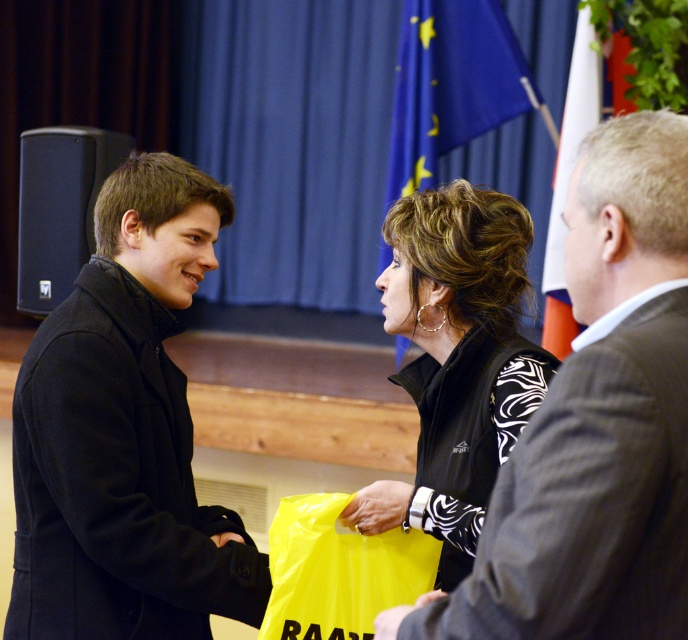
You are an event organizer who needs to ensure the flags are spaced exactly 24 inches apart for the ceremony. Based on the image, are the blue fabric flag at upper center and white fabric flag at right positioned correctly?

The blue fabric flag at upper center and white fabric flag at right are 24.43 inches apart from each other, which is slightly more than the required 24 inches. Therefore, they are positioned correctly as they meet the spacing requirement.